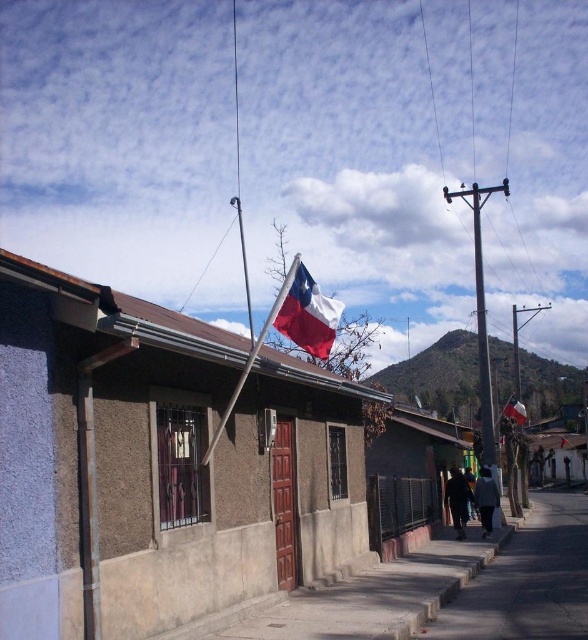
Who is lower down, wooden flag pole at upper center or polished wood flag at center?

polished wood flag at center is below.

Does wooden flag pole at upper center have a larger size compared to polished wood flag at center?

Yes, wooden flag pole at upper center is bigger than polished wood flag at center.

Image resolution: width=588 pixels, height=640 pixels. Identify the location of wooden flag pole at upper center. (255, 352).

What do you see at coordinates (308, 314) in the screenshot? I see `polished fabric flag at center` at bounding box center [308, 314].

Which of these two, polished fabric flag at center or wooden flag pole at upper center, stands shorter?

polished fabric flag at center

Where is `polished fabric flag at center`? polished fabric flag at center is located at coordinates (308, 314).

Does polished fabric flag at center appear on the left side of polished wood flag at center?

Indeed, polished fabric flag at center is positioned on the left side of polished wood flag at center.

Who is more forward, (275, 323) or (514, 417)?

Point (275, 323) is in front.

Who is more forward, (289, 296) or (506, 417)?

Positioned in front is point (289, 296).

Where is `polished fabric flag at center`? polished fabric flag at center is located at coordinates (308, 314).